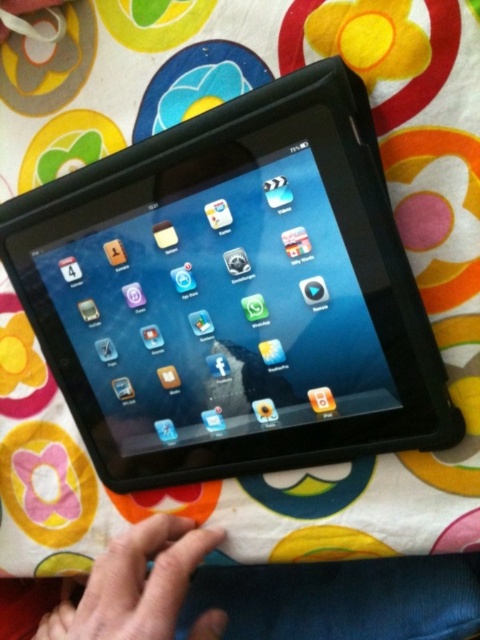
Between black matte tablet at center and skinny flesh-toned hand at lower left, which one appears on the right side from the viewer's perspective?

From the viewer's perspective, black matte tablet at center appears more on the right side.

Which is behind, point (327, 243) or point (169, 572)?

The point (327, 243) is more distant.

Find the location of a particular element. The width and height of the screenshot is (480, 640). black matte tablet at center is located at coordinates (232, 292).

Locate an element on the screen. black matte tablet at center is located at coordinates (232, 292).